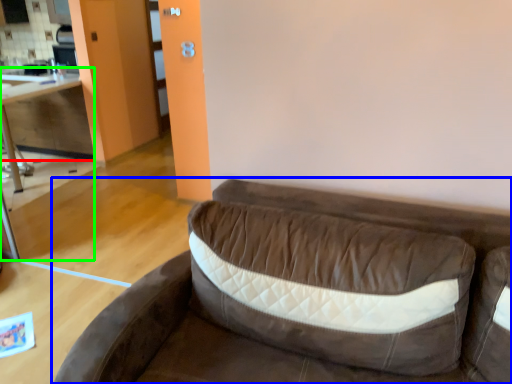
Question: Based on their relative distances, which object is nearer to cabinetry (highlighted by a red box)? Choose from studio couch (highlighted by a blue box) and table (highlighted by a green box).

Choices:
 (A) studio couch
 (B) table

Answer: (B)